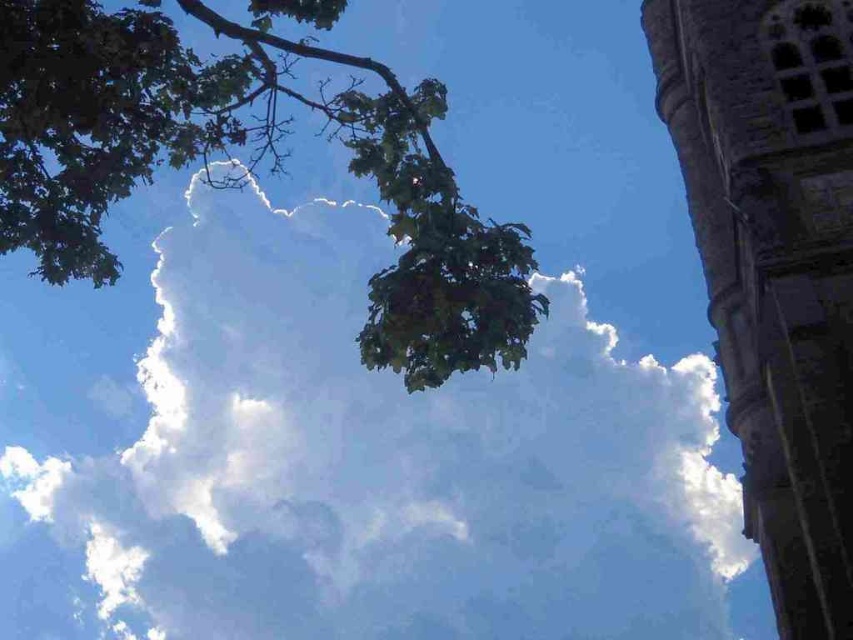
From the picture: You are an architect designing a new garden and want to replicate the scene in the image. If you want to place a stone tower in your garden similar to the stone tower at upper right, where should you position it relative to the green leafy tree at upper left?

The stone tower at upper right should be positioned below the green leafy tree at upper left since the green leafy tree at upper left is located above the stone tower at upper right in the original image.

You are standing in the middle of the scene and want to take a photo of the white fluffy cloud at upper center. Based on its position, in which direction should you point your camera to capture it?

The white fluffy cloud at upper center is located at coordinates approximately 0.723 on the x axis and 0.456 on the y axis. Since you are standing in the middle, pointing the camera towards the upper right direction would capture the cloud.

You are a photographer planning to capture the white fluffy cloud at upper center and the stone tower at upper right in the same frame. Based on their sizes in the image, which object would appear more prominent in your photo?

The white fluffy cloud at upper center would appear more prominent in the photo since it has a larger size compared to the stone tower at upper right.